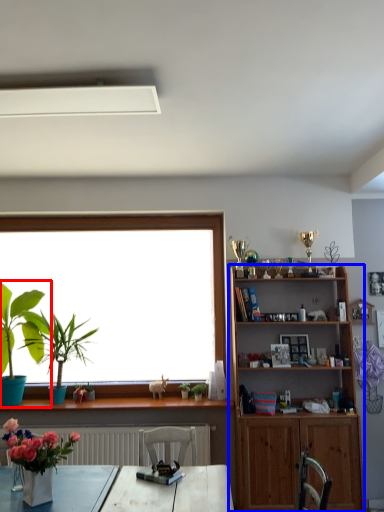
Question: Among these objects, which one is nearest to the camera, houseplant (highlighted by a red box) or shelf (highlighted by a blue box)?

Choices:
 (A) houseplant
 (B) shelf

Answer: (B)